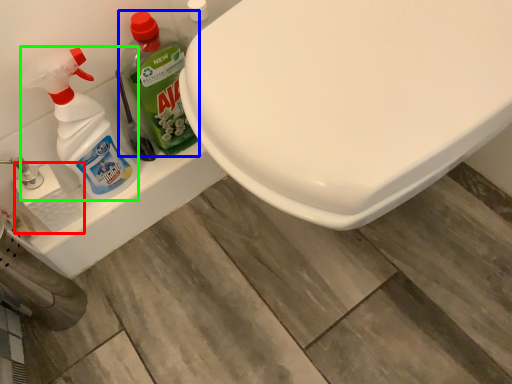
Question: Which object is the farthest from toilet paper (highlighted by a red box)? Choose among these: cleaning product (highlighted by a blue box) or cleaning product (highlighted by a green box).

Choices:
 (A) cleaning product
 (B) cleaning product

Answer: (A)